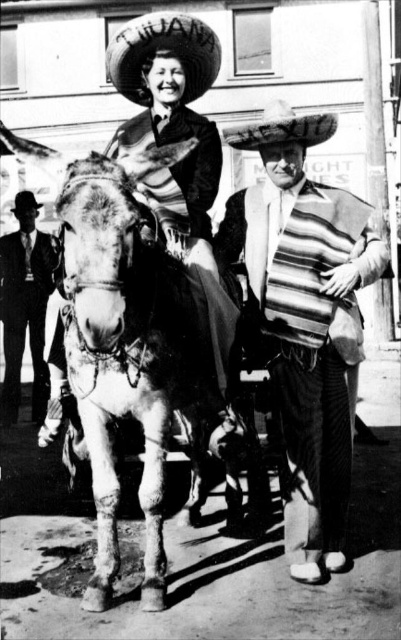
Question: Is smooth black suit at left wider than black felt cowboy hat at upper left?

Choices:
 (A) no
 (B) yes

Answer: (B)

Question: Estimate the real-world distances between objects in this image. Which object is closer to the white felt sombrero at upper center?

Choices:
 (A) black felt cowboy hat at upper left
 (B) white felt sombrero at center
 (C) striped fabric accordion at center
 (D) gray textured mule at center

Answer: (B)

Question: Can you confirm if striped fabric accordion at center is thinner than white felt sombrero at upper center?

Choices:
 (A) yes
 (B) no

Answer: (B)

Question: Is white felt sombrero at upper center thinner than white felt sombrero at center?

Choices:
 (A) yes
 (B) no

Answer: (B)

Question: Which point is closer to the camera?

Choices:
 (A) (34, 205)
 (B) (249, 244)
 (C) (145, 413)

Answer: (C)

Question: Which object is the closest to the gray textured mule at center?

Choices:
 (A) white felt sombrero at center
 (B) white felt sombrero at upper center
 (C) smooth black suit at left
 (D) black felt cowboy hat at upper left

Answer: (A)